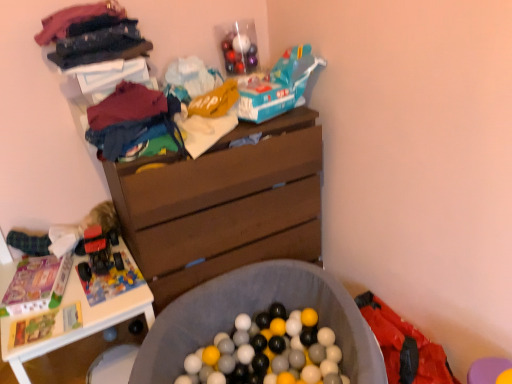
Question: From a real-world perspective, is white plastic table at lower left located higher than matte cotton t-shirt at upper left, which ranks as the 2th clothing in top-to-bottom order?

Choices:
 (A) yes
 (B) no

Answer: (B)

Question: Can you confirm if white plastic table at lower left is taller than matte cotton t-shirt at upper left, which ranks as the 2th clothing in top-to-bottom order?

Choices:
 (A) yes
 (B) no

Answer: (A)

Question: Is white plastic table at lower left touching matte cotton t-shirt at upper left, which ranks as the 2th clothing in top-to-bottom order?

Choices:
 (A) no
 (B) yes

Answer: (A)

Question: Does white plastic table at lower left have a greater width compared to matte cotton t-shirt at upper left, the 1th clothing positioned from the bottom?

Choices:
 (A) no
 (B) yes

Answer: (B)

Question: Can you confirm if white plastic table at lower left is bigger than matte cotton t-shirt at upper left, the 1th clothing positioned from the bottom?

Choices:
 (A) no
 (B) yes

Answer: (B)

Question: Is white plastic table at lower left positioned beyond the bounds of matte cotton t-shirt at upper left, which ranks as the 2th clothing in top-to-bottom order?

Choices:
 (A) yes
 (B) no

Answer: (A)

Question: Is brown wood chest of drawers at center to the right of velvet-like fabric at upper left, which appears as the second clothing when ordered from the bottom, from the viewer's perspective?

Choices:
 (A) no
 (B) yes

Answer: (B)

Question: Does brown wood chest of drawers at center have a greater width compared to velvet-like fabric at upper left, which appears as the second clothing when ordered from the bottom?

Choices:
 (A) no
 (B) yes

Answer: (B)

Question: From a real-world perspective, is brown wood chest of drawers at center beneath velvet-like fabric at upper left, the first clothing from the top?

Choices:
 (A) yes
 (B) no

Answer: (A)

Question: Is velvet-like fabric at upper left, the first clothing from the top, a part of brown wood chest of drawers at center?

Choices:
 (A) no
 (B) yes

Answer: (A)

Question: From the image's perspective, is brown wood chest of drawers at center located above velvet-like fabric at upper left, which appears as the second clothing when ordered from the bottom?

Choices:
 (A) no
 (B) yes

Answer: (A)

Question: Is brown wood chest of drawers at center closer to camera compared to velvet-like fabric at upper left, the first clothing from the top?

Choices:
 (A) yes
 (B) no

Answer: (B)

Question: Is the position of matte cotton t-shirt at upper left, the 1th clothing positioned from the bottom, less distant than that of red fabric underclothes at lower right?

Choices:
 (A) yes
 (B) no

Answer: (B)